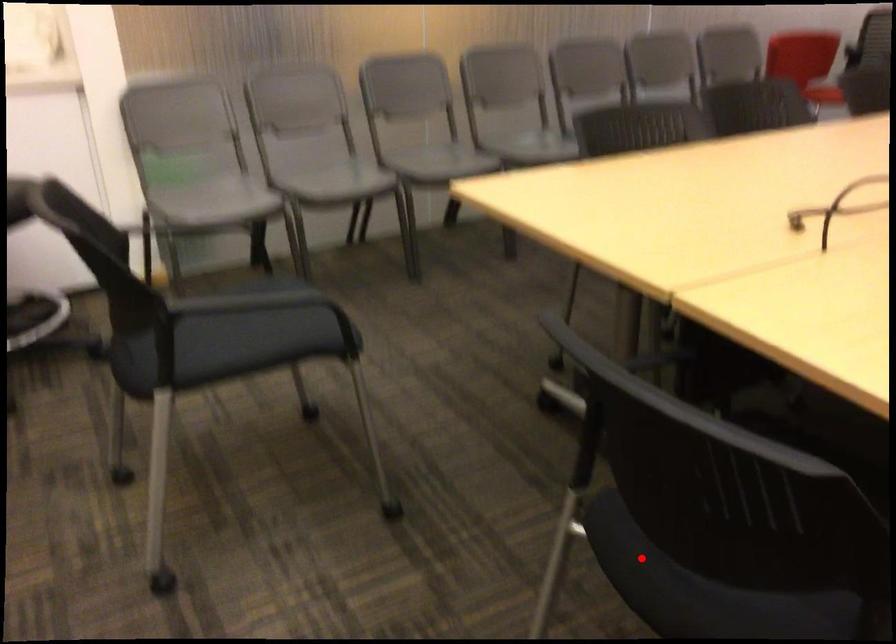
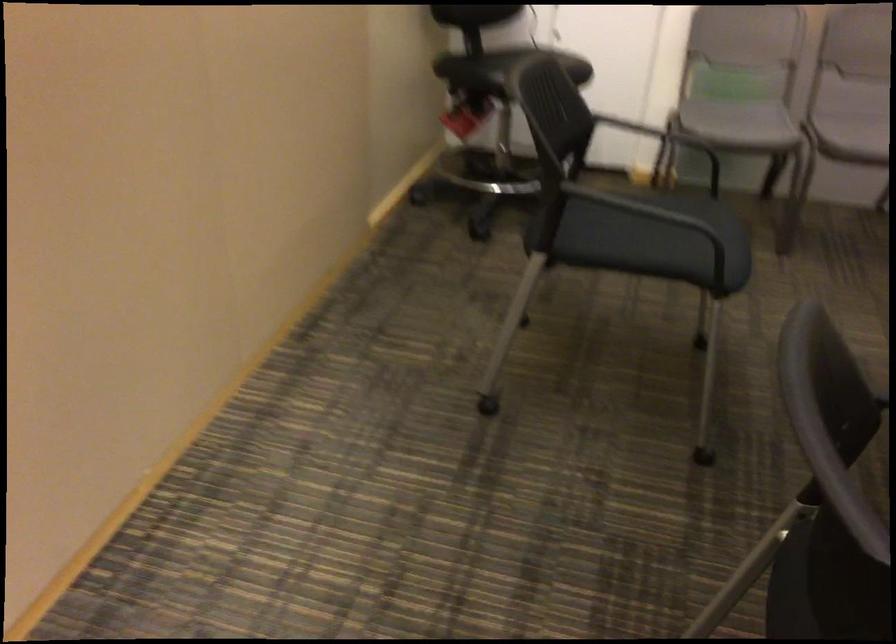
Where in the second image is the point corresponding to the highlighted location from the first image?

(826, 585)